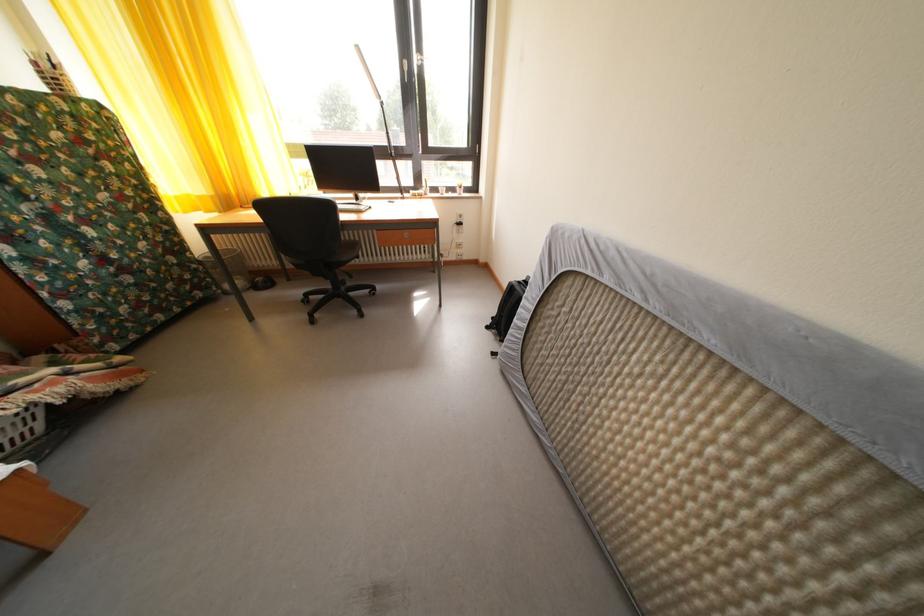
You are a GUI agent. You are given a task and a screenshot of the screen. Output one action in this format:
    pyautogui.click(x=<x>, y=<y>)
    Task: Click on the grey mattress topper
    The width and height of the screenshot is (924, 616).
    Given the screenshot: What is the action you would take?
    pyautogui.click(x=767, y=345)